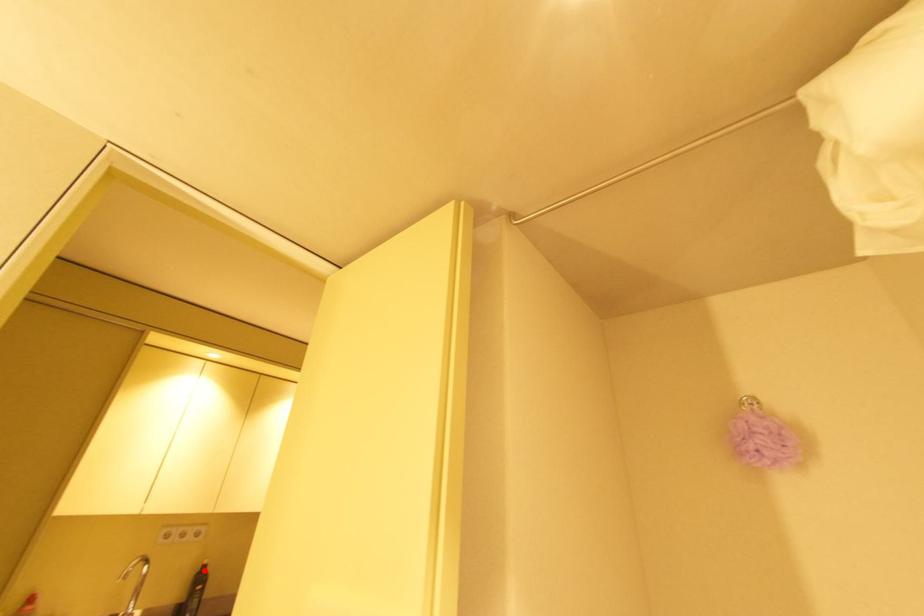
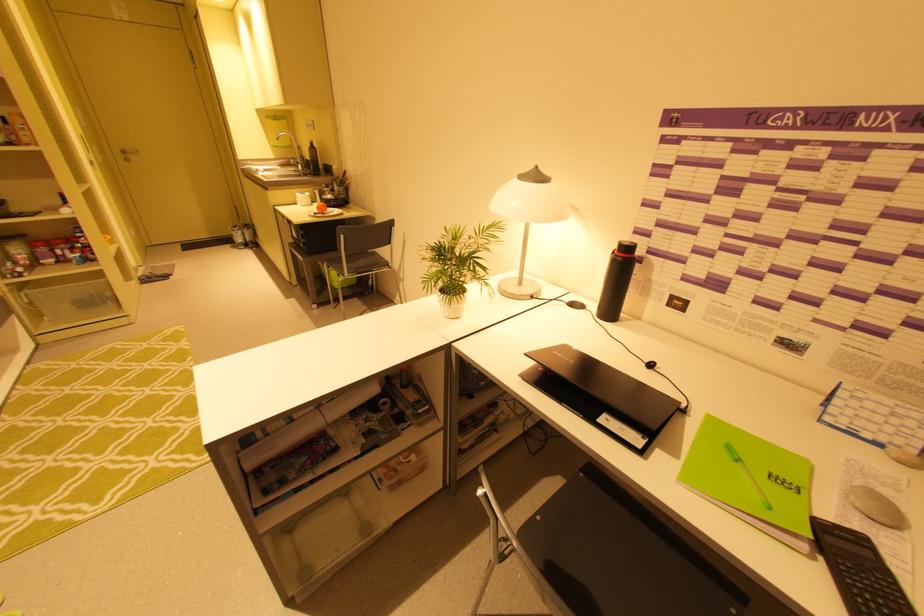
Find the pixel in the second image that matches the highlighted location in the first image.

(313, 146)